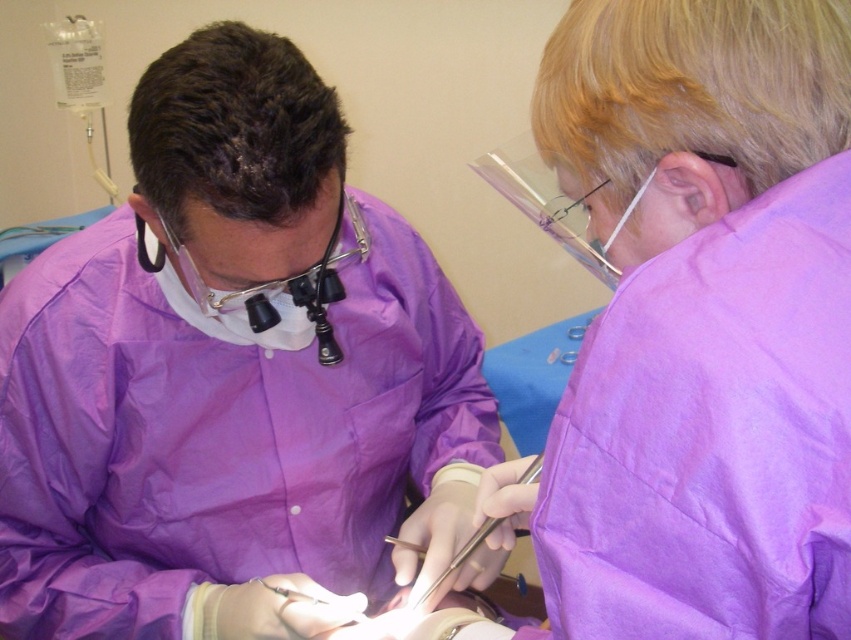
Does purple matte surgical gown at center appear under metallic silver scalpel at center?

Incorrect, purple matte surgical gown at center is not positioned below metallic silver scalpel at center.

In the scene shown: Who is more distant from viewer, (240,628) or (466,556)?

Positioned behind is point (466,556).

Image resolution: width=851 pixels, height=640 pixels. What are the coordinates of `purple matte surgical gown at center` in the screenshot? It's located at (233, 378).